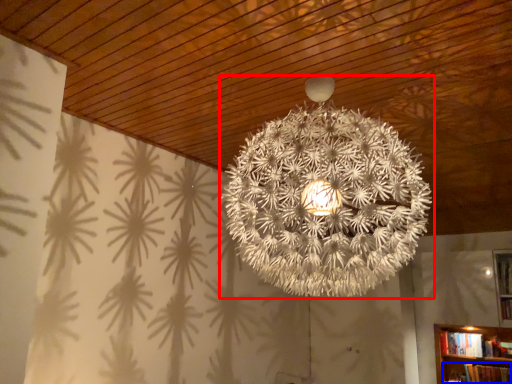
Question: Among these objects, which one is farthest to the camera, lamp (highlighted by a red box) or book (highlighted by a blue box)?

Choices:
 (A) lamp
 (B) book

Answer: (B)